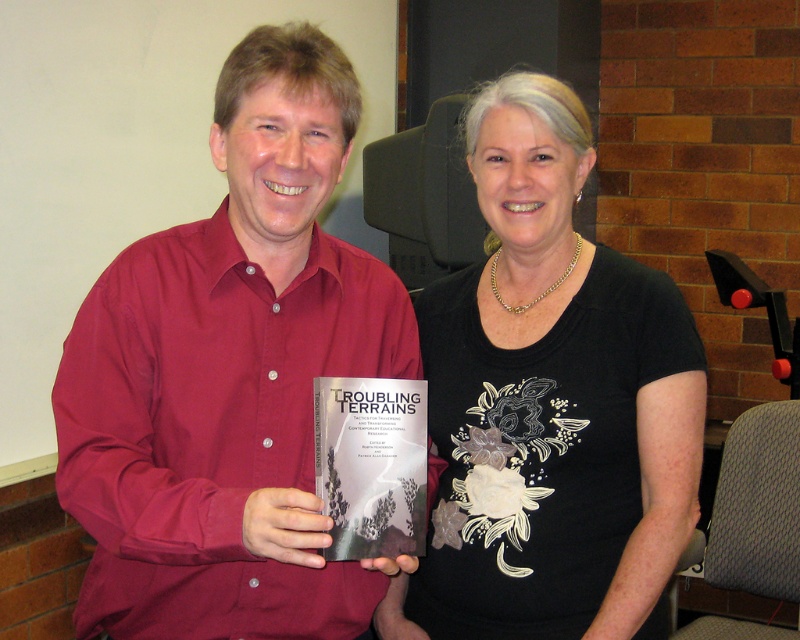
Can you confirm if black matte shirt at center is bigger than matte gray book at center?

Yes.

Describe the element at coordinates (550, 403) in the screenshot. I see `black matte shirt at center` at that location.

I want to click on black matte shirt at center, so pyautogui.click(x=550, y=403).

This screenshot has height=640, width=800. In order to click on black matte shirt at center in this screenshot , I will do `click(550, 403)`.

Does matte red shirt at center appear on the left side of black matte shirt at center?

Yes, matte red shirt at center is to the left of black matte shirt at center.

Which is in front, point (289, 208) or point (406, 596)?

Point (289, 208) is in front.

Who is more distant from viewer, (x=304, y=188) or (x=594, y=342)?

Positioned behind is point (x=594, y=342).

This screenshot has height=640, width=800. I want to click on matte red shirt at center, so click(x=230, y=376).

Is point (178, 326) positioned behind point (318, 404)?

Yes, it is.

Is matte red shirt at center below matte gray book at center?

No, matte red shirt at center is not below matte gray book at center.

This screenshot has width=800, height=640. Describe the element at coordinates (230, 376) in the screenshot. I see `matte red shirt at center` at that location.

Where is `matte red shirt at center`? The width and height of the screenshot is (800, 640). matte red shirt at center is located at coordinates (230, 376).